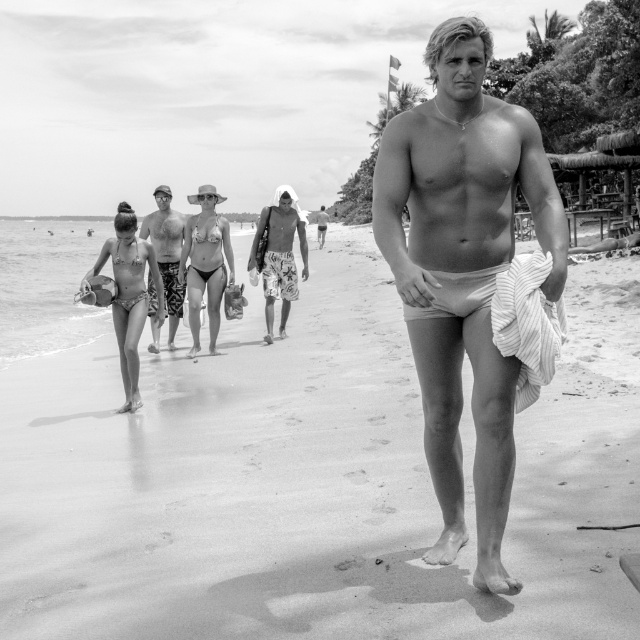
Based on the scene described, can you determine which object is closer to the observer? Please consider the smooth sand at center and the matte bikini at left in your answer.

The smooth sand at center is closer to the observer because it is positioned in front of the matte bikini at left.

Based on the scene description, can you determine which object is closer to the observer between the white matte shorts at center and the patterned swim trunks at center?

The white matte shorts at center is in front of the patterned swim trunks at center, so the white matte shorts at center is closer to the observer.